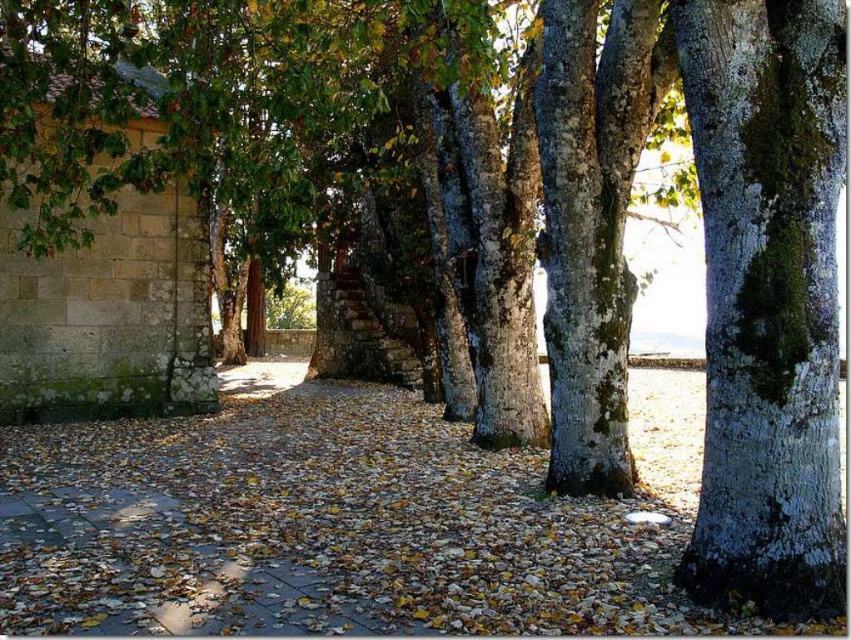
Question: Does brown stone pavement at center have a larger size compared to green mossy bark tree at right?

Choices:
 (A) yes
 (B) no

Answer: (A)

Question: Does brown stone pavement at center have a larger size compared to green mossy bark tree at right?

Choices:
 (A) yes
 (B) no

Answer: (A)

Question: Is brown stone pavement at center positioned before green mossy bark tree at right?

Choices:
 (A) yes
 (B) no

Answer: (A)

Question: Which point appears closest to the camera in this image?

Choices:
 (A) (785, 548)
 (B) (260, 611)

Answer: (A)